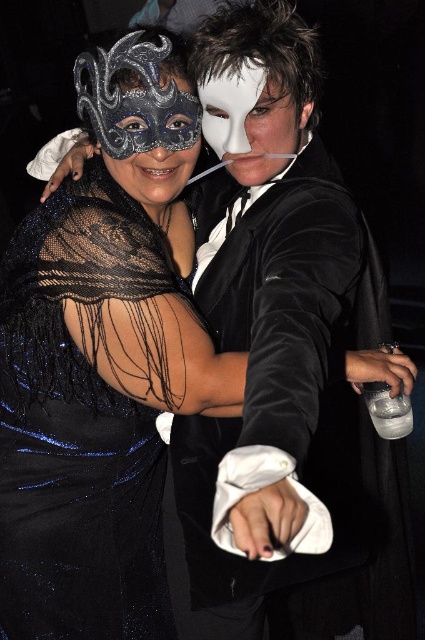
You are standing in the middle of the image and want to move towards the point marked at coordinates (79, 426). Which direction should you go?

The point marked at coordinates (79, 426) corresponds to the black sequined dress at left. Since you are in the middle of the image, you should move to the left to reach it.

You are a photographer trying to capture a closeup of the white matte mask at center. Based on the coordinates provided, where should you focus your camera?

The white matte mask at center is located at point [237,120], so you should focus your camera there.